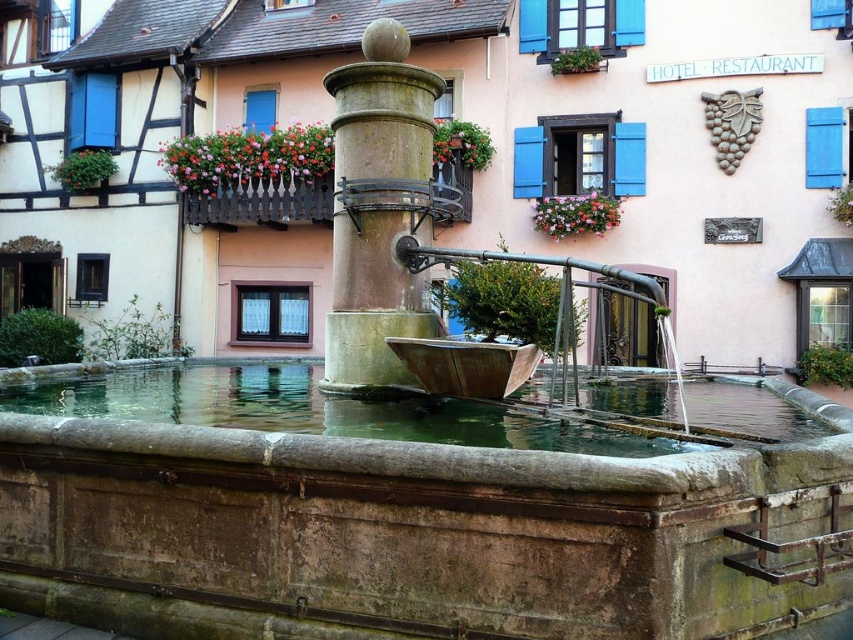
Question: Which object appears closest to the camera in this image?

Choices:
 (A) brown stone water at center
 (B) greenish stone fountain at center

Answer: (A)

Question: Is green stone water at center further to camera compared to greenish stone fountain at center?

Choices:
 (A) no
 (B) yes

Answer: (A)

Question: Estimate the real-world distances between objects in this image. Which object is farther from the greenish stone fountain at center?

Choices:
 (A) green stone water at center
 (B) brown stone water at center

Answer: (B)

Question: Which point appears farthest from the camera in this image?

Choices:
 (A) (100, 388)
 (B) (181, 532)

Answer: (A)

Question: Is brown stone water at center wider than greenish stone fountain at center?

Choices:
 (A) yes
 (B) no

Answer: (A)

Question: Can you confirm if brown stone water at center is thinner than green stone water at center?

Choices:
 (A) no
 (B) yes

Answer: (A)